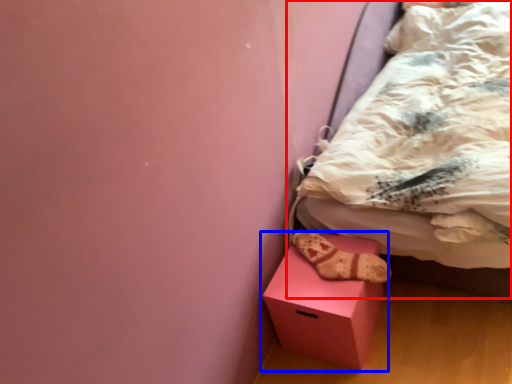
Question: Which object appears farthest to the camera in this image, bed (highlighted by a red box) or box (highlighted by a blue box)?

Choices:
 (A) bed
 (B) box

Answer: (B)